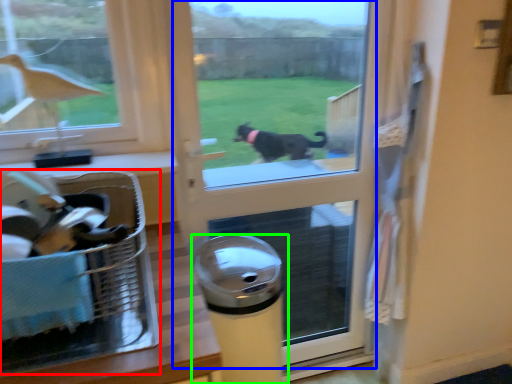
Question: Based on their relative distances, which object is nearer to laundry basket (highlighted by a red box)? Choose from screen door (highlighted by a blue box) and waste container (highlighted by a green box).

Choices:
 (A) screen door
 (B) waste container

Answer: (B)